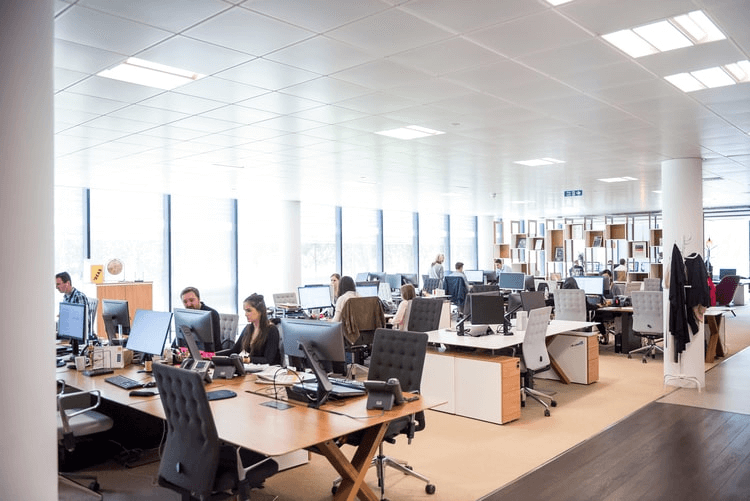
The width and height of the screenshot is (750, 501). What are the coordinates of `light on ceiling` in the screenshot? It's located at (669, 32), (702, 81), (660, 189), (616, 178), (546, 163), (555, 1), (408, 128), (156, 70).